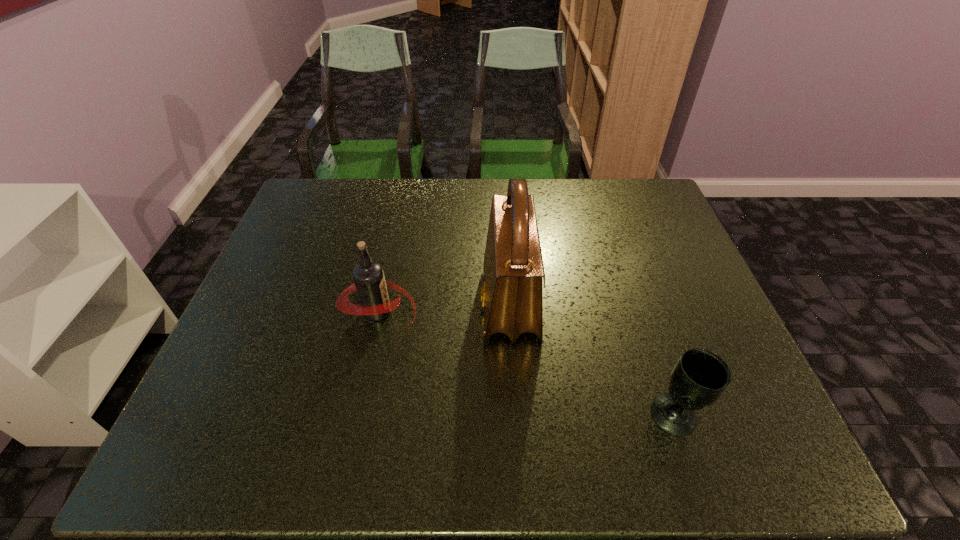
Where is `free space between the tallest object and the shortest object`? The width and height of the screenshot is (960, 540). free space between the tallest object and the shortest object is located at coordinates (592, 360).

What are the coordinates of `empty space between the root beer and the rightmost object` in the screenshot? It's located at (526, 363).

This screenshot has width=960, height=540. Find the location of `unoccupied position between the leftmost object and the shoulder bag`. unoccupied position between the leftmost object and the shoulder bag is located at coordinates (444, 308).

At what (x,y) coordinates should I click in order to perform the action: click on free spot between the second object from left to right and the chalice. Please return your answer as a coordinate pair (x, y). This screenshot has height=540, width=960. Looking at the image, I should click on (592, 360).

You are a GUI agent. You are given a task and a screenshot of the screen. Output one action in this format:
    pyautogui.click(x=<x>, y=<y>)
    Task: Click on the vacant space that's between the tallest object and the nearest object
    Image resolution: width=960 pixels, height=540 pixels.
    Given the screenshot: What is the action you would take?
    pyautogui.click(x=592, y=360)

I want to click on free space between the rightmost object and the leftmost object, so click(x=526, y=363).

This screenshot has width=960, height=540. I want to click on vacant space in between the leftmost object and the second object from left to right, so click(x=444, y=308).

Find the location of a particular element. Image resolution: width=960 pixels, height=540 pixels. unoccupied position between the tallest object and the second shortest object is located at coordinates [444, 308].

Identify the location of object that ranks as the closest to the tallest object. (369, 281).

This screenshot has width=960, height=540. What are the coordinates of `object that ranks as the second closest to the rightmost object` in the screenshot? It's located at (369, 281).